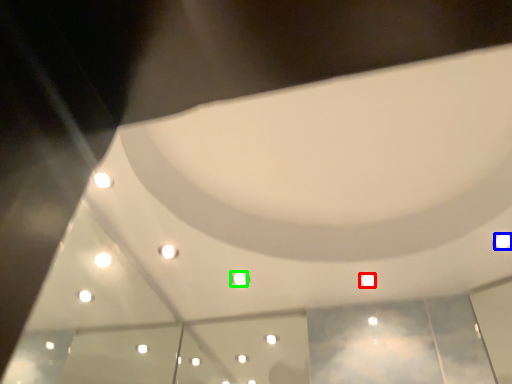
Question: Based on their relative distances, which object is nearer to light (highlighted by a red box)? Choose from light (highlighted by a blue box) and light (highlighted by a green box).

Choices:
 (A) light
 (B) light

Answer: (A)